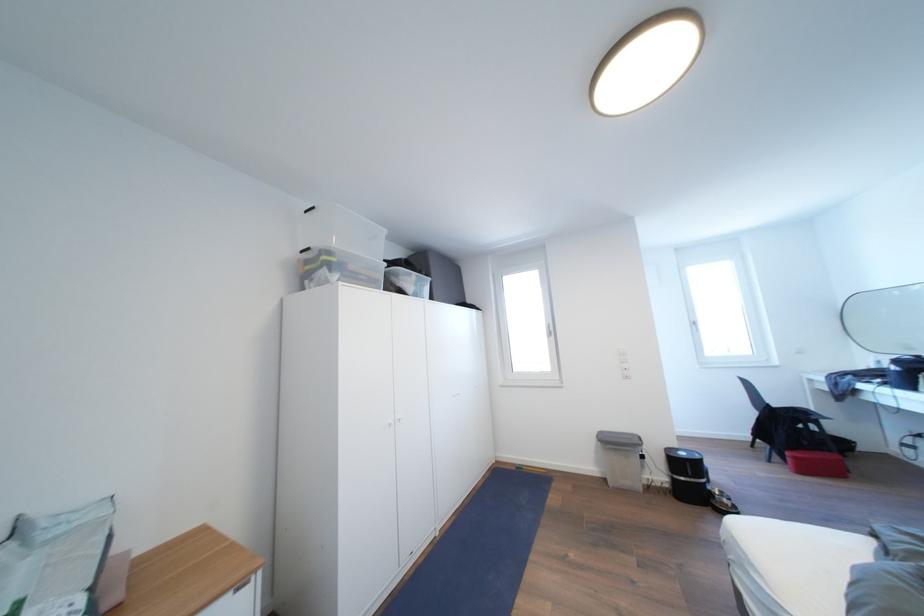
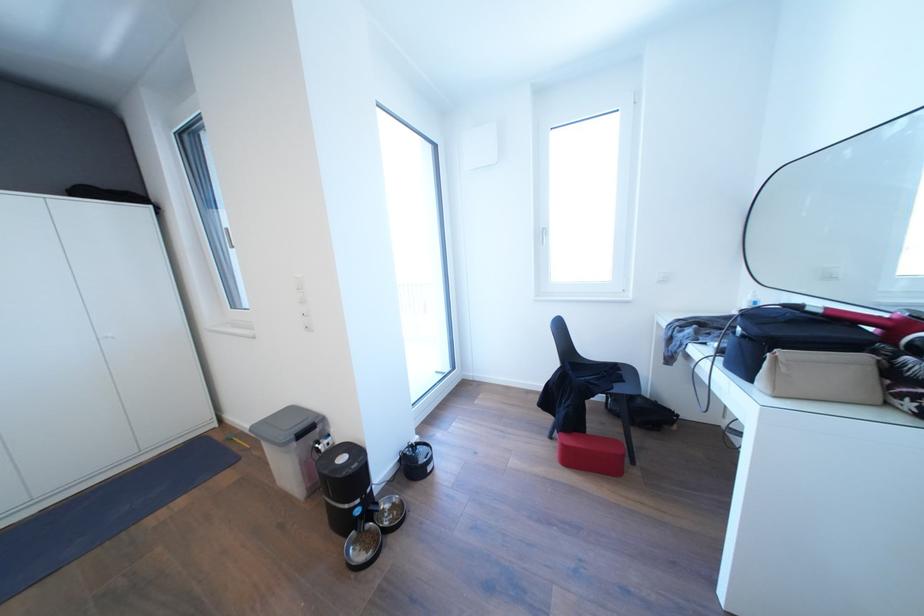
The images are taken continuously from a first-person perspective. In which direction are you moving?

The cameraman walked toward right, forward.